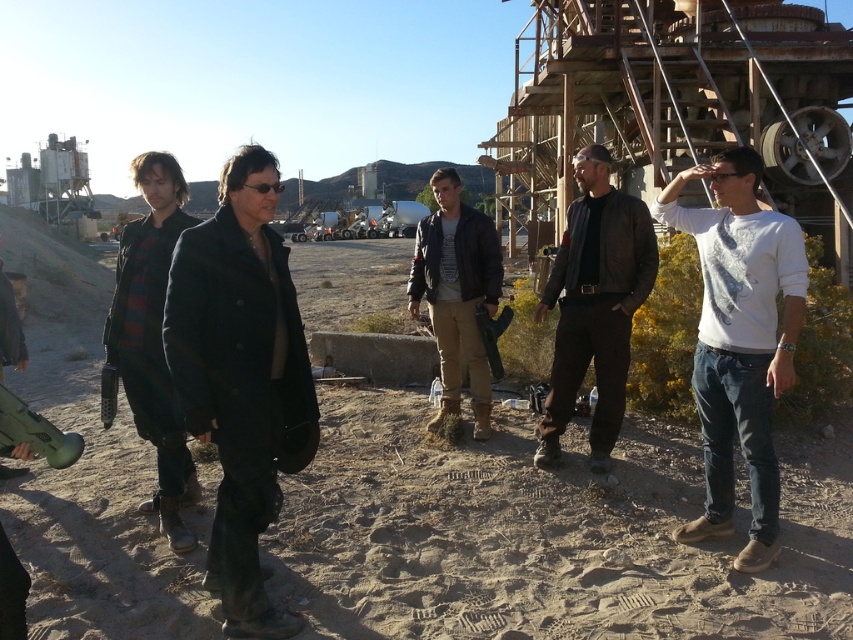
Question: Among these objects, which one is farthest from the camera?

Choices:
 (A) green matte guitar at lower left
 (B) dirt field at center
 (C) black leather jacket at center
 (D) white cotton shirt at right

Answer: (D)

Question: Observing the image, what is the correct spatial positioning of black leather jacket at center in reference to green matte guitar at lower left?

Choices:
 (A) right
 (B) left

Answer: (A)

Question: Does brown leather jacket at center have a greater width compared to dark blue leather jacket at center?

Choices:
 (A) no
 (B) yes

Answer: (A)

Question: Considering the real-world distances, which object is farthest from the black leather jacket at center?

Choices:
 (A) dirt field at center
 (B) dark blue leather jacket at center

Answer: (A)

Question: Which object is positioned farthest from the brown leather jacket at center?

Choices:
 (A) dark blue leather jacket at center
 (B) white cotton shirt at right
 (C) black leather jacket at center

Answer: (A)

Question: Does leather jacket at center have a lesser width compared to green matte guitar at lower left?

Choices:
 (A) yes
 (B) no

Answer: (B)